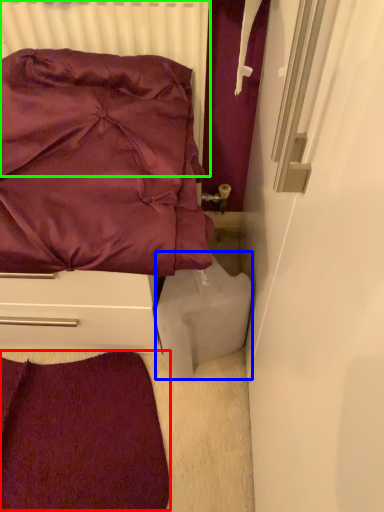
Question: Which object is the closest to the violet (highlighted by a red box)? Choose among these: wide (highlighted by a blue box) or radiator (highlighted by a green box).

Choices:
 (A) wide
 (B) radiator

Answer: (A)